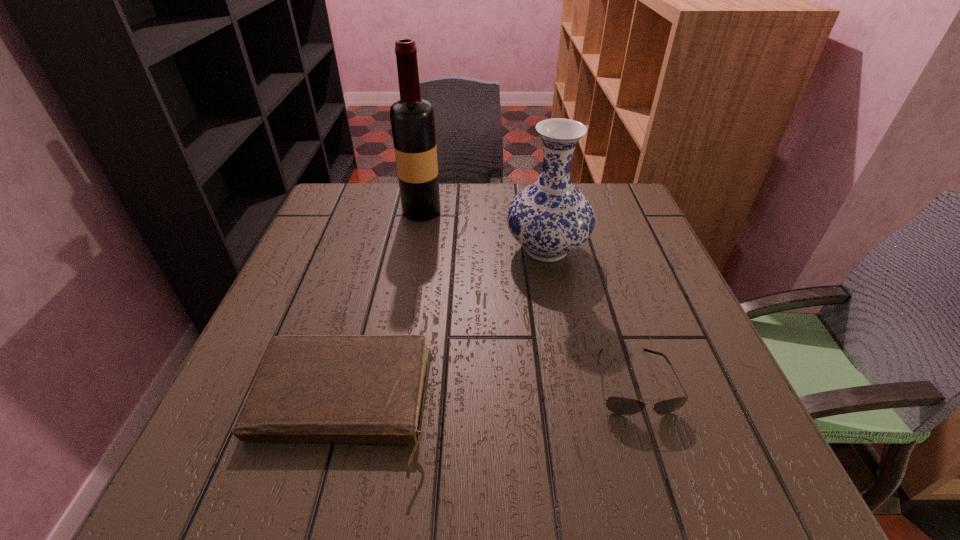
At what (x,y) coordinates should I click in order to perform the action: click on wine bottle. Please return your answer as a coordinate pair (x, y). The image size is (960, 540). Looking at the image, I should click on (412, 119).

Identify the location of the farthest object. Image resolution: width=960 pixels, height=540 pixels. pyautogui.click(x=412, y=119).

Find the location of a particular element. vase is located at coordinates (549, 218).

The image size is (960, 540). In order to click on the second tallest object in this screenshot , I will do coord(549,218).

The image size is (960, 540). In order to click on sunglasses in this screenshot , I will do coord(619,405).

Locate an element on the screen. Image resolution: width=960 pixels, height=540 pixels. paperback book is located at coordinates (309, 388).

At what (x,y) coordinates should I click in order to perform the action: click on free space located on the front of the wine bottle. Please return your answer as a coordinate pair (x, y). Looking at the image, I should click on (409, 282).

The width and height of the screenshot is (960, 540). In order to click on free region located on the left of the second tallest object in this screenshot , I will do `click(441, 249)`.

You are a GUI agent. You are given a task and a screenshot of the screen. Output one action in this format:
    pyautogui.click(x=<x>, y=<y>)
    Task: Click on the wine bottle that is positioned at the far edge
    This screenshot has height=540, width=960.
    Given the screenshot: What is the action you would take?
    pyautogui.click(x=412, y=119)

Find the location of `vase present at the far edge`. vase present at the far edge is located at coordinates (549, 218).